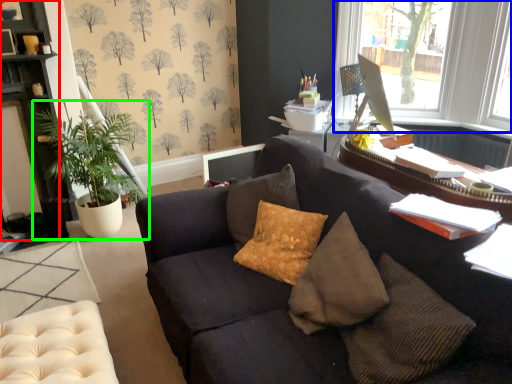
Question: Based on their relative distances, which object is nearer to cabinetry (highlighted by a red box)? Choose from window (highlighted by a blue box) and houseplant (highlighted by a green box).

Choices:
 (A) window
 (B) houseplant

Answer: (B)